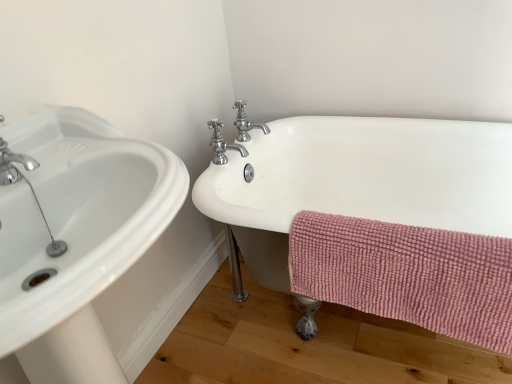
Question: From a real-world perspective, is chrome/metallic faucet at upper center, acting as the first tap starting from the back, positioned above or below white ceramic bathtub at right?

Choices:
 (A) above
 (B) below

Answer: (A)

Question: Is chrome/metallic faucet at upper center, acting as the first tap starting from the back, taller or shorter than white ceramic bathtub at right?

Choices:
 (A) tall
 (B) short

Answer: (B)

Question: Which object is the farthest from the white glossy sink at left?

Choices:
 (A) polished chrome faucet at upper center, which is counted as the 1th tap, starting from the front
 (B) chrome/metallic faucet at upper center, acting as the first tap starting from the back
 (C) pink chenille towel at lower right
 (D) white ceramic bathtub at right

Answer: (B)

Question: Which is nearer to the pink chenille towel at lower right?

Choices:
 (A) white glossy sink at left
 (B) polished chrome faucet at upper center, the second tap when ordered from back to front
 (C) white ceramic bathtub at right
 (D) chrome/metallic faucet at upper center, acting as the first tap starting from the back

Answer: (C)